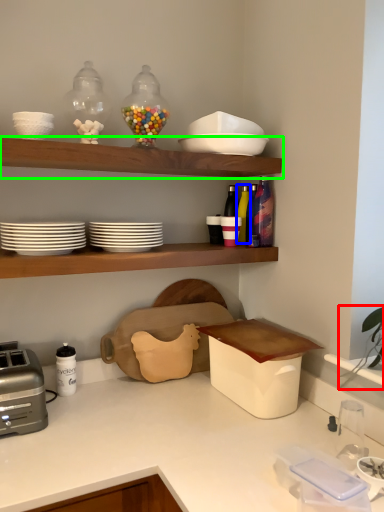
Question: Which object is positioned closest to plant (highlighted by a red box)? Select from bottle (highlighted by a blue box) and shelf (highlighted by a green box).

Choices:
 (A) bottle
 (B) shelf

Answer: (A)